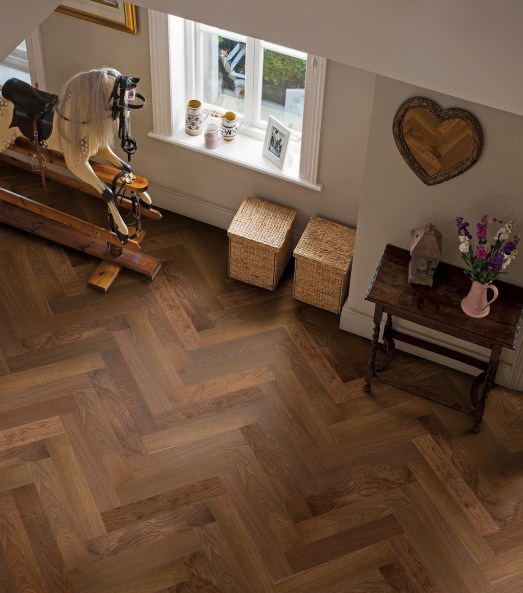
The image size is (523, 593). I want to click on rocking horse, so click(90, 181).